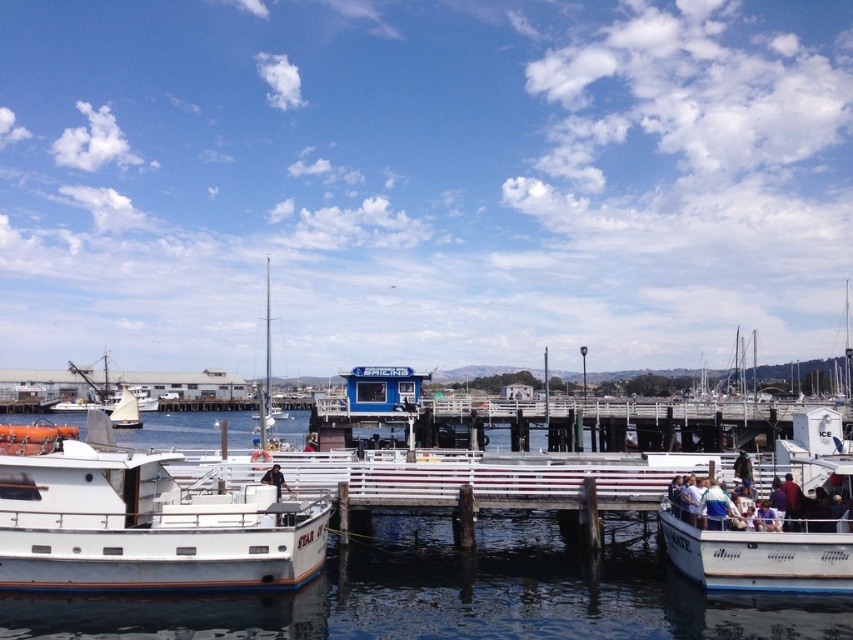
Can you confirm if white glossy water at center is positioned to the right of white matte boat at lower right?

No, white glossy water at center is not to the right of white matte boat at lower right.

Does point (527, 513) come farther from viewer compared to point (809, 582)?

Yes.

Which is in front, point (782, 605) or point (819, 483)?

Point (782, 605) is in front.

Locate an element on the screen. The image size is (853, 640). white glossy water at center is located at coordinates (456, 593).

Between white matte boat at lower right and white sailboat at left, which one has less height?

white matte boat at lower right is shorter.

Consider the image. Between white matte boat at lower right and white sailboat at left, which one has more height?

With more height is white sailboat at left.

Describe the element at coordinates (769, 540) in the screenshot. I see `white matte boat at lower right` at that location.

The height and width of the screenshot is (640, 853). Identify the location of white matte boat at lower right. (769, 540).

Which is behind, point (282, 513) or point (813, 566)?

The point (282, 513) is more distant.

Between white glossy boat at left and white matte boat at lower right, which one has more height?

With more height is white glossy boat at left.

Locate an element on the screen. The height and width of the screenshot is (640, 853). white glossy boat at left is located at coordinates (144, 525).